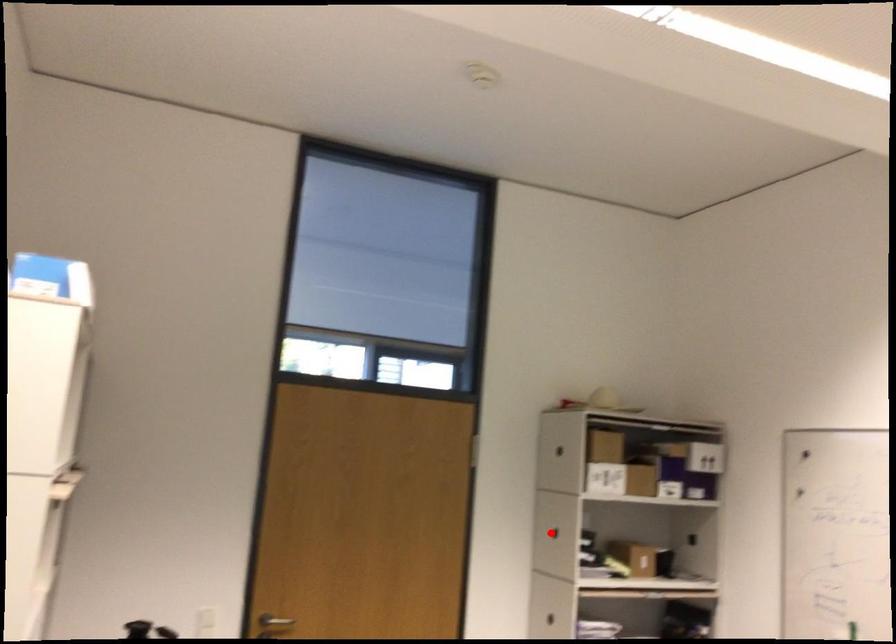
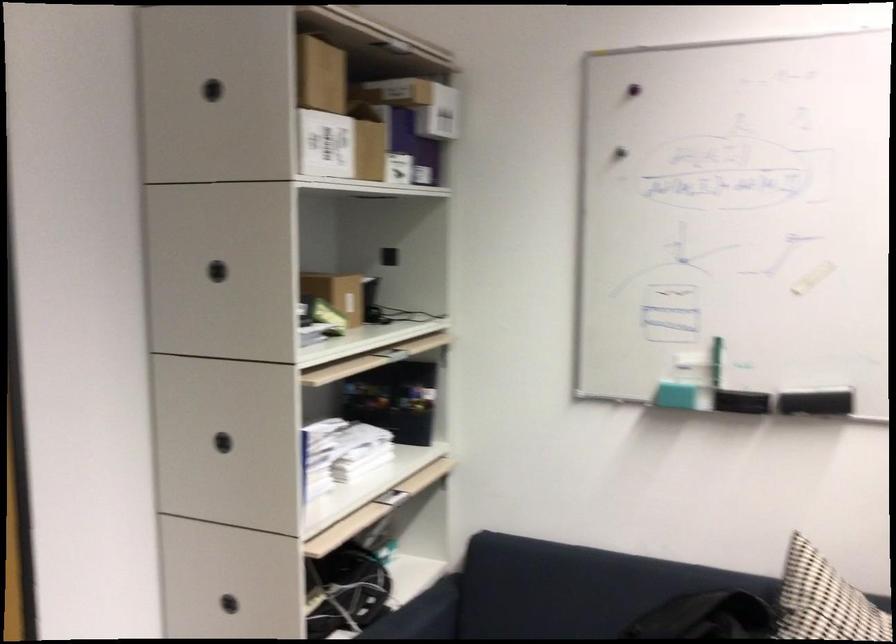
In the second image, find the point that corresponds to the highlighted location in the first image.

(217, 270)